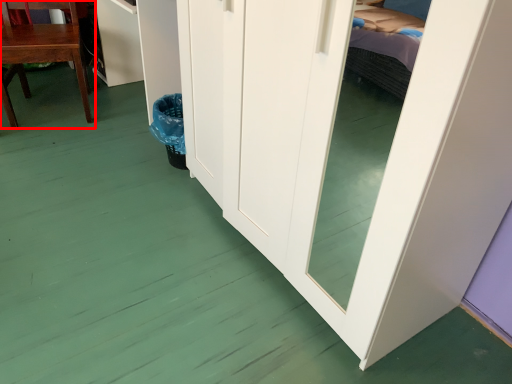
Question: Observing the image, what is the correct spatial positioning of chair (annotated by the red box) in reference to cabinetry?

Choices:
 (A) right
 (B) left

Answer: (B)